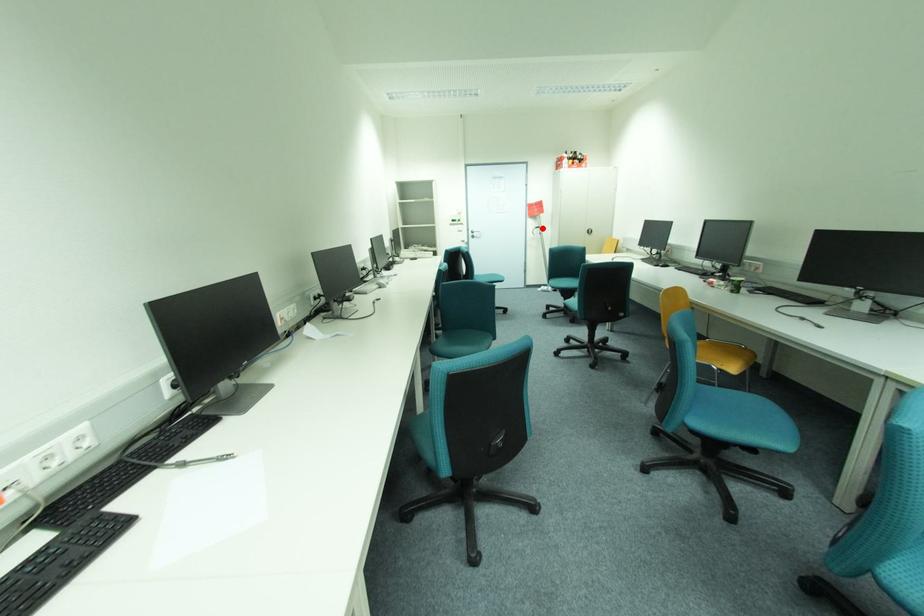
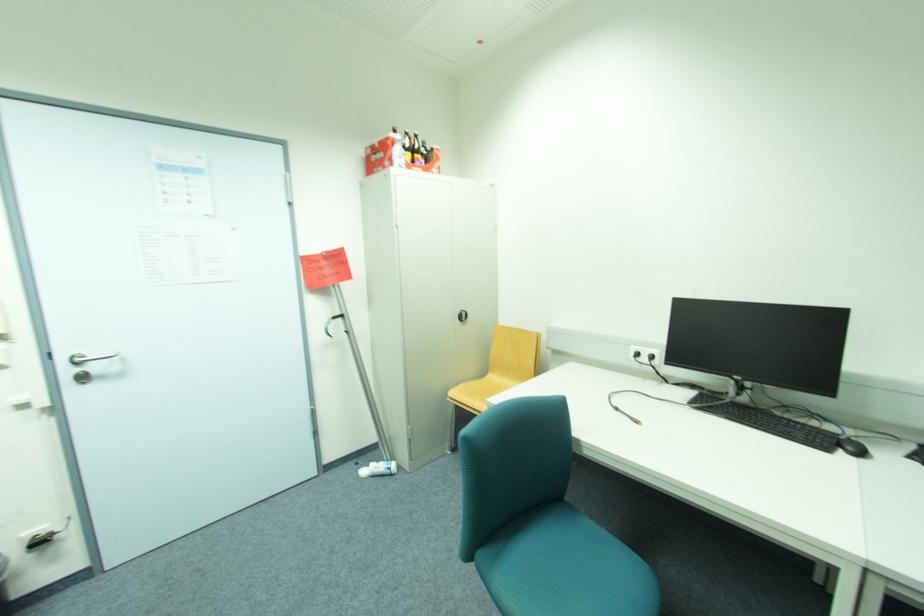
Question: I am providing you with two images of the same scene from different viewpoints. In image1, a red point is highlighted. Considering the same 3D point in image2, which of the following is correct?

Choices:
 (A) It is closer
 (B) It is farther

Answer: (B)